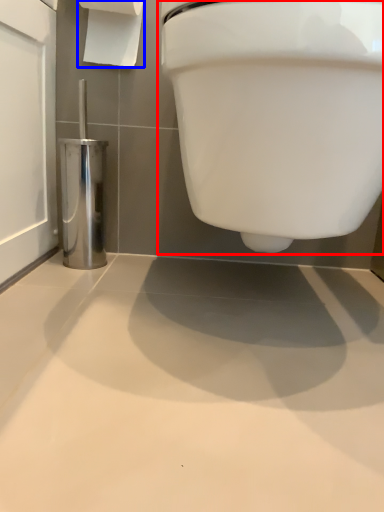
Question: Which object appears closest to the camera in this image, toilet (highlighted by a red box) or toilet paper (highlighted by a blue box)?

Choices:
 (A) toilet
 (B) toilet paper

Answer: (A)